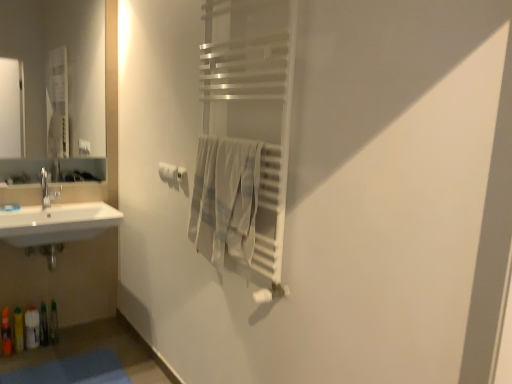
Question: Does satin silver towel rack at center turn towards white matte toilet paper at center?

Choices:
 (A) yes
 (B) no

Answer: (B)

Question: From the image's perspective, is satin silver towel rack at center over white matte toilet paper at center?

Choices:
 (A) yes
 (B) no

Answer: (A)

Question: Is satin silver towel rack at center smaller than white matte toilet paper at center?

Choices:
 (A) no
 (B) yes

Answer: (A)

Question: Is satin silver towel rack at center taller than white matte toilet paper at center?

Choices:
 (A) no
 (B) yes

Answer: (B)

Question: Is satin silver towel rack at center wider than white matte toilet paper at center?

Choices:
 (A) yes
 (B) no

Answer: (A)

Question: Is satin silver towel rack at center turned away from white matte toilet paper at center?

Choices:
 (A) yes
 (B) no

Answer: (B)

Question: Is blue fabric bath mat at lower left to the right of satin silver towel rack at center from the viewer's perspective?

Choices:
 (A) no
 (B) yes

Answer: (A)

Question: Can satin silver towel rack at center be found inside blue fabric bath mat at lower left?

Choices:
 (A) yes
 (B) no

Answer: (B)

Question: Could you tell me if blue fabric bath mat at lower left is facing satin silver towel rack at center?

Choices:
 (A) no
 (B) yes

Answer: (A)

Question: Is satin silver towel rack at center at the back of blue fabric bath mat at lower left?

Choices:
 (A) yes
 (B) no

Answer: (B)

Question: Is blue fabric bath mat at lower left far from satin silver towel rack at center?

Choices:
 (A) yes
 (B) no

Answer: (A)

Question: From the image's perspective, is blue fabric bath mat at lower left over satin silver towel rack at center?

Choices:
 (A) yes
 (B) no

Answer: (B)

Question: Does satin silver towel rack at center have a greater height compared to light beige cotton towel at center?

Choices:
 (A) yes
 (B) no

Answer: (A)